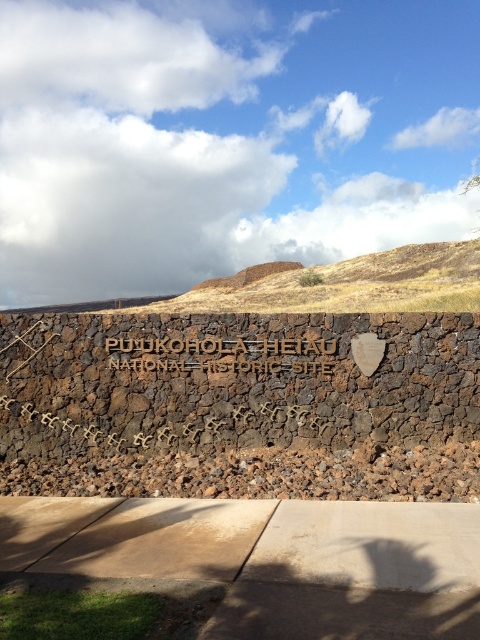
Is brown volcanic rock at center smaller than gold textured sign at center?

Yes.

Can you confirm if brown volcanic rock at center is bigger than gold textured sign at center?

Incorrect, brown volcanic rock at center is not larger than gold textured sign at center.

Which is in front, point (127, 467) or point (137, 362)?

Point (127, 467) is in front.

Locate an element on the screen. The height and width of the screenshot is (640, 480). brown volcanic rock at center is located at coordinates (240, 404).